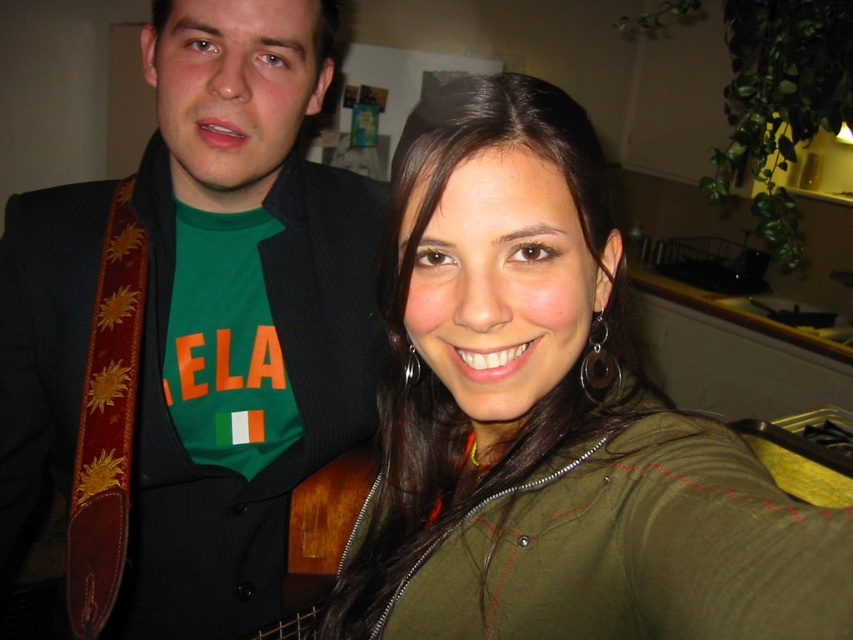
Does green fabric shirt at upper left have a lesser height compared to green fabric jacket at center?

No, green fabric shirt at upper left is not shorter than green fabric jacket at center.

Can you confirm if green fabric shirt at upper left is taller than green fabric jacket at center?

Correct, green fabric shirt at upper left is much taller as green fabric jacket at center.

Is point (73, 600) farther from viewer compared to point (488, 522)?

That is True.

The height and width of the screenshot is (640, 853). Find the location of `green fabric shirt at upper left`. green fabric shirt at upper left is located at coordinates (190, 332).

Is green fabric shirt at upper left below brown wooden guitar at center?

No.

From the picture: Is green fabric shirt at upper left above brown wooden guitar at center?

Indeed, green fabric shirt at upper left is positioned over brown wooden guitar at center.

Which is behind, point (45, 221) or point (297, 573)?

The point (297, 573) is more distant.

Identify the location of green fabric shirt at upper left. (190, 332).

Does point (577, 136) lie in front of point (315, 477)?

Yes, it is.

This screenshot has height=640, width=853. In order to click on green fabric jacket at center in this screenshot , I will do (554, 424).

You are a GUI agent. You are given a task and a screenshot of the screen. Output one action in this format:
    pyautogui.click(x=<x>, y=<y>)
    Task: Click on the green fabric jacket at center
    The image size is (853, 640).
    Given the screenshot: What is the action you would take?
    pyautogui.click(x=554, y=424)

In order to click on green fabric jacket at center in this screenshot , I will do `click(554, 424)`.